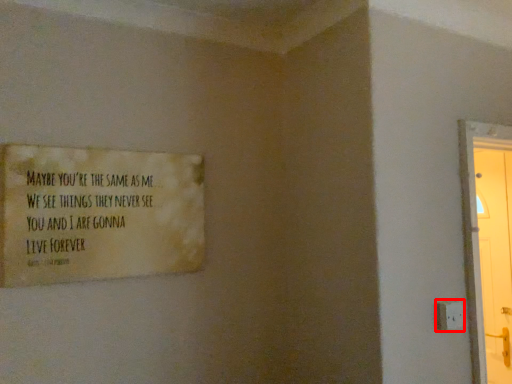
Question: From the image's perspective, what is the correct spatial positioning of electric outlet (annotated by the red box) in reference to poster?

Choices:
 (A) above
 (B) below

Answer: (B)